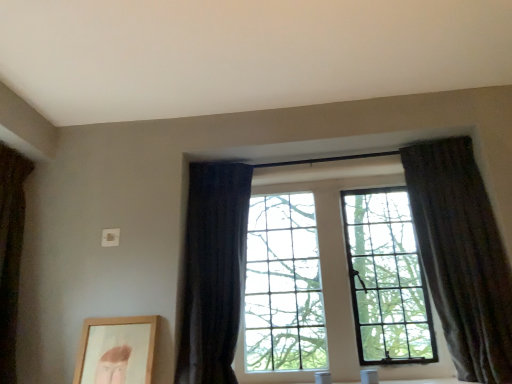
Question: Is dark fabric curtain at center, the 2th curtain viewed from the left, further to camera compared to dark fabric curtain at left, acting as the first curtain starting from the left?

Choices:
 (A) no
 (B) yes

Answer: (B)

Question: Does dark fabric curtain at center, the 2th curtain viewed from the left, appear on the left side of dark fabric curtain at left, acting as the first curtain starting from the left?

Choices:
 (A) yes
 (B) no

Answer: (B)

Question: Does dark fabric curtain at center, placed as the second curtain when sorted from right to left, have a larger size compared to dark fabric curtain at left, acting as the first curtain starting from the left?

Choices:
 (A) yes
 (B) no

Answer: (A)

Question: From the image's perspective, is dark fabric curtain at center, the 2th curtain viewed from the left, on top of dark fabric curtain at left, which is the third curtain from right to left?

Choices:
 (A) no
 (B) yes

Answer: (A)

Question: Is dark fabric curtain at center, placed as the second curtain when sorted from right to left, oriented away from dark fabric curtain at left, which is the third curtain from right to left?

Choices:
 (A) no
 (B) yes

Answer: (A)

Question: From a real-world perspective, is dark fabric curtain at center, the 2th curtain viewed from the left, physically located above or below wooden picture frame at lower left?

Choices:
 (A) above
 (B) below

Answer: (A)

Question: Considering their positions, is dark fabric curtain at center, the 2th curtain viewed from the left, located in front of or behind wooden picture frame at lower left?

Choices:
 (A) front
 (B) behind

Answer: (A)

Question: From their relative heights in the image, would you say dark fabric curtain at center, placed as the second curtain when sorted from right to left, is taller or shorter than wooden picture frame at lower left?

Choices:
 (A) short
 (B) tall

Answer: (B)

Question: Based on their sizes in the image, would you say dark fabric curtain at center, placed as the second curtain when sorted from right to left, is bigger or smaller than wooden picture frame at lower left?

Choices:
 (A) small
 (B) big

Answer: (B)

Question: Considering the relative positions of wooden picture frame at lower left and dark fabric curtain at left, acting as the first curtain starting from the left, in the image provided, is wooden picture frame at lower left to the left or to the right of dark fabric curtain at left, acting as the first curtain starting from the left,?

Choices:
 (A) right
 (B) left

Answer: (A)

Question: Is point (99, 359) positioned closer to the camera than point (8, 158)?

Choices:
 (A) closer
 (B) farther

Answer: (A)

Question: From a real-world perspective, relative to dark fabric curtain at left, acting as the first curtain starting from the left, is wooden picture frame at lower left vertically above or below?

Choices:
 (A) below
 (B) above

Answer: (A)

Question: Is wooden picture frame at lower left spatially inside dark fabric curtain at left, acting as the first curtain starting from the left, or outside of it?

Choices:
 (A) inside
 (B) outside

Answer: (B)

Question: Is dark fabric curtain at left, which is the third curtain from right to left, inside or outside of wooden picture frame at lower left?

Choices:
 (A) inside
 (B) outside

Answer: (B)

Question: From the image's perspective, is dark fabric curtain at left, acting as the first curtain starting from the left, above or below wooden picture frame at lower left?

Choices:
 (A) below
 (B) above

Answer: (B)